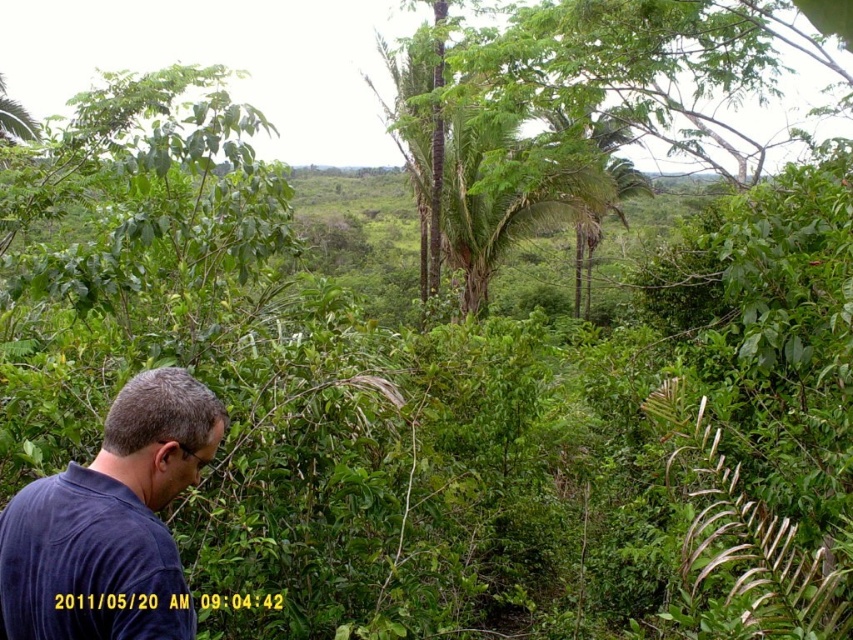
Who is more distant from viewer, (770, 4) or (126, 442)?

Positioned behind is point (770, 4).

Which is more to the left, green leafy tree at center or dark blue shirt at lower left?

From the viewer's perspective, dark blue shirt at lower left appears more on the left side.

This screenshot has height=640, width=853. What do you see at coordinates (604, 74) in the screenshot?
I see `green leafy tree at center` at bounding box center [604, 74].

Locate an element on the screen. This screenshot has height=640, width=853. green leafy tree at center is located at coordinates (604, 74).